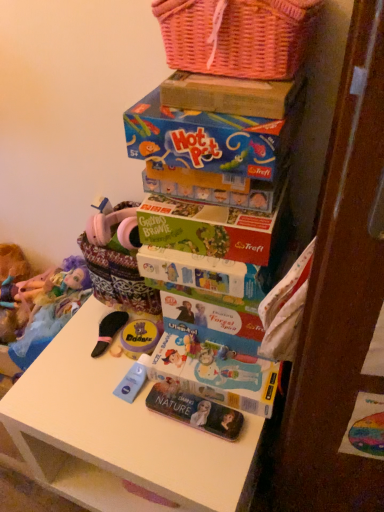
Question: Considering the positions of cardboard box at upper center and matte yellow container at center, marked as the 2th toy in a back-to-front arrangement, in the image, is cardboard box at upper center bigger or smaller than matte yellow container at center, marked as the 2th toy in a back-to-front arrangement,?

Choices:
 (A) small
 (B) big

Answer: (B)

Question: Is point (218, 76) positioned closer to the camera than point (144, 346)?

Choices:
 (A) farther
 (B) closer

Answer: (B)

Question: Which is farther from the metallic silver magazine at lower center?

Choices:
 (A) matt paper comic book at center
 (B) blue cardboard hot pot game at upper center
 (C) white matte table at center
 (D) plush doll at left, which is the first toy in back-to-front order
 (E) pink wicker basket at upper center

Answer: (E)

Question: Which of these objects is positioned closest to the blue cardboard hot pot game at upper center?

Choices:
 (A) matt paper comic book at center
 (B) plush doll at left, acting as the 2th toy starting from the right
 (C) green matte board game at center
 (D) matte yellow container at center, acting as the 1th toy starting from the front
 (E) metallic silver magazine at lower center

Answer: (C)